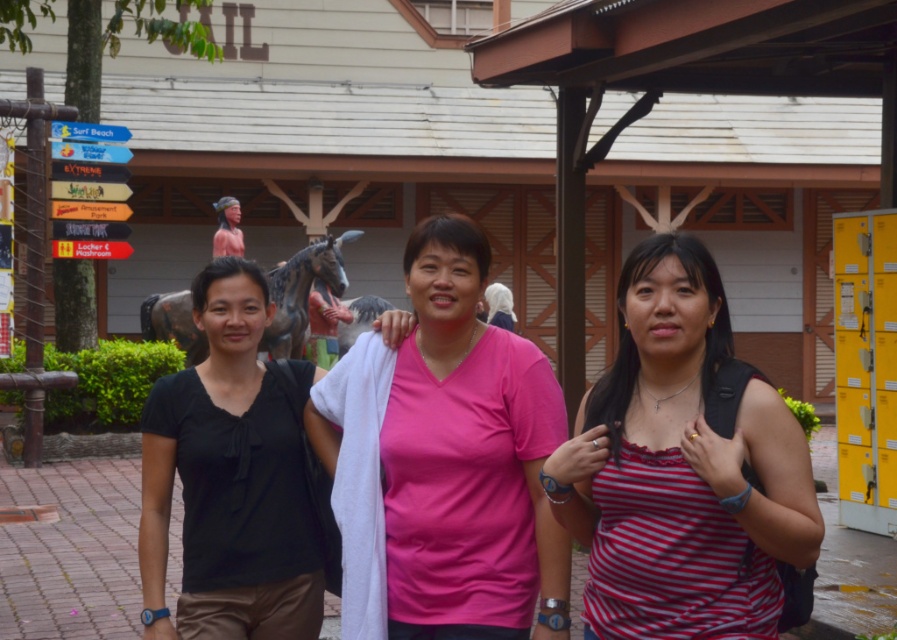
Question: Which point is closer to the camera?

Choices:
 (A) striped cotton tank top at center
 (B) pink matte shirt at center

Answer: (A)

Question: Which point is farther to the camera?

Choices:
 (A) striped cotton tank top at center
 (B) black matte shirt at left
 (C) pink matte shirt at center

Answer: (B)

Question: Can you confirm if striped cotton tank top at center is smaller than pink matte shirt at center?

Choices:
 (A) no
 (B) yes

Answer: (A)

Question: Can you confirm if pink matte shirt at center is thinner than black matte shirt at left?

Choices:
 (A) no
 (B) yes

Answer: (A)

Question: Which object is farther from the camera taking this photo?

Choices:
 (A) black matte shirt at left
 (B) pink matte shirt at center

Answer: (A)

Question: Is striped cotton tank top at center positioned at the back of black matte shirt at left?

Choices:
 (A) no
 (B) yes

Answer: (A)